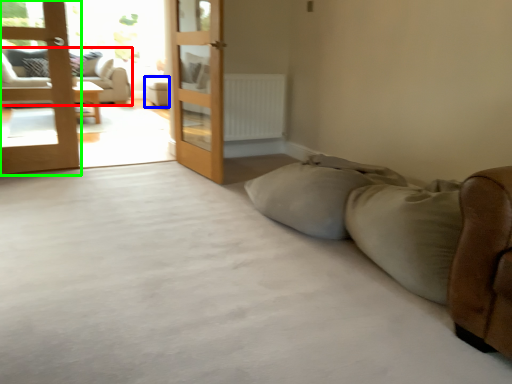
Question: Estimate the real-world distances between objects in this image. Which object is farther from studio couch (highlighted by a red box), furniture (highlighted by a blue box) or door (highlighted by a green box)?

Choices:
 (A) furniture
 (B) door

Answer: (B)